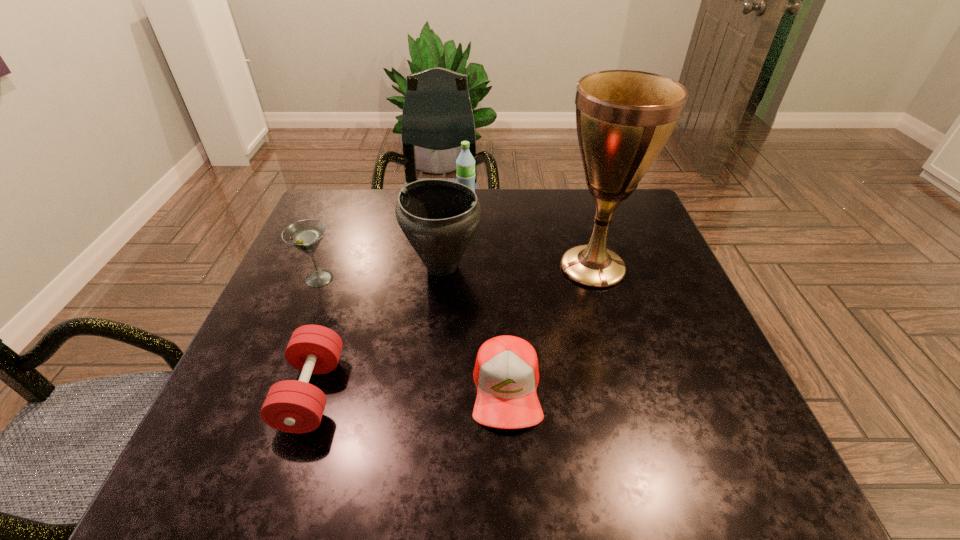
Identify the location of the rightmost object. Image resolution: width=960 pixels, height=540 pixels. (624, 118).

This screenshot has height=540, width=960. In order to click on the tallest object in this screenshot , I will do `click(624, 118)`.

This screenshot has width=960, height=540. I want to click on urn, so click(438, 217).

The width and height of the screenshot is (960, 540). I want to click on water bottle, so click(465, 163).

Locate an element on the screen. The height and width of the screenshot is (540, 960). the third shortest object is located at coordinates (305, 235).

I want to click on dumbbell, so click(291, 406).

Where is `baseball cap`? baseball cap is located at coordinates (506, 374).

At what (x,y) coordinates should I click in order to perform the action: click on blank space located 0.060m on the right of the rightmost object. Please return your answer as a coordinate pair (x, y). The image size is (960, 540). Looking at the image, I should click on (657, 267).

Identify the location of vacant space situated 0.330m on the front of the urn. The width and height of the screenshot is (960, 540). (428, 420).

You are a GUI agent. You are given a task and a screenshot of the screen. Output one action in this format:
    pyautogui.click(x=<x>, y=<y>)
    Task: Click on the free spot located 0.310m on the left of the water bottle
    This screenshot has width=960, height=540.
    Given the screenshot: What is the action you would take?
    pyautogui.click(x=353, y=204)